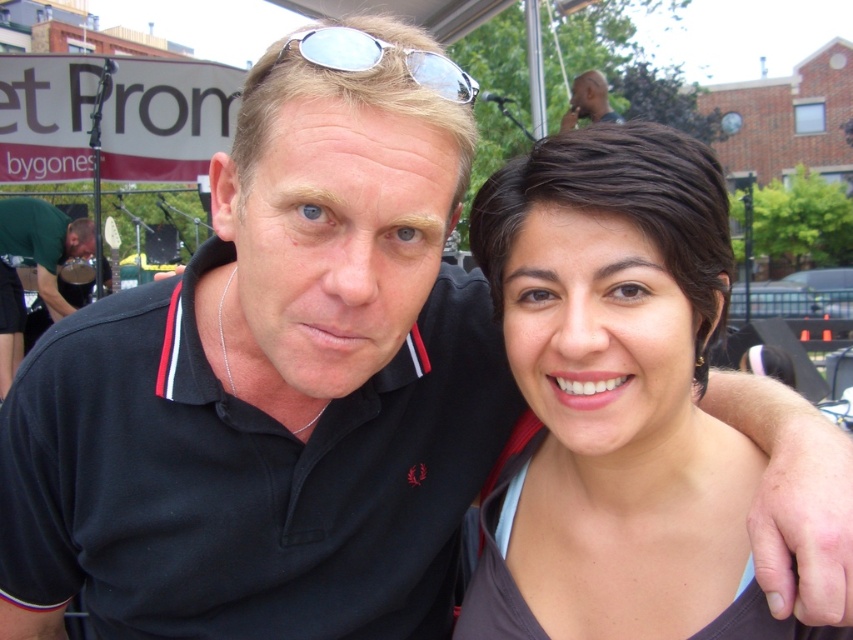
Question: Which point is closer to the camera?

Choices:
 (A) matte black hair at center
 (B) smooth skin head at upper center
 (C) silver reflective sunglasses at upper center

Answer: (C)

Question: Which of the following is the farthest from the observer?

Choices:
 (A) (612, 113)
 (B) (331, 58)

Answer: (A)

Question: Is matte black hair at center to the right of silver reflective sunglasses at upper center from the viewer's perspective?

Choices:
 (A) yes
 (B) no

Answer: (A)

Question: Is matte black hair at center in front of silver reflective sunglasses at upper center?

Choices:
 (A) yes
 (B) no

Answer: (B)

Question: Can you confirm if matte black hair at center is positioned above green matte shirt at left?

Choices:
 (A) no
 (B) yes

Answer: (A)

Question: Which object is closer to the camera taking this photo?

Choices:
 (A) green matte shirt at left
 (B) smooth skin head at upper center

Answer: (A)